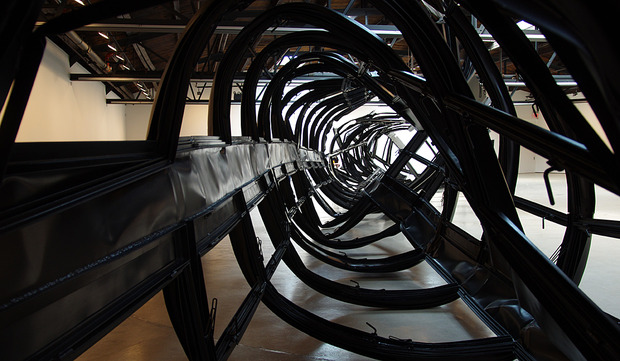
Locate an element on the screen. This screenshot has height=361, width=620. floor is located at coordinates (273, 336).